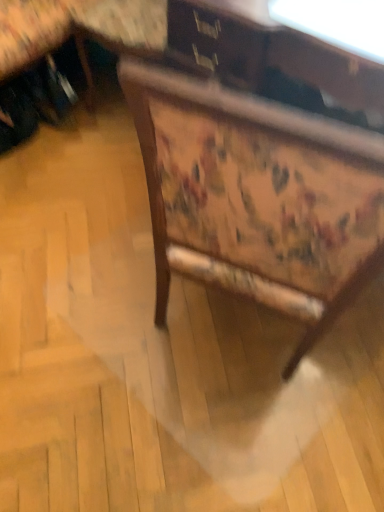
Locate an element on the screen. vacant space underneath wooden floral-patterned dresser at center (from a real-world perspective) is located at coordinates (223, 326).